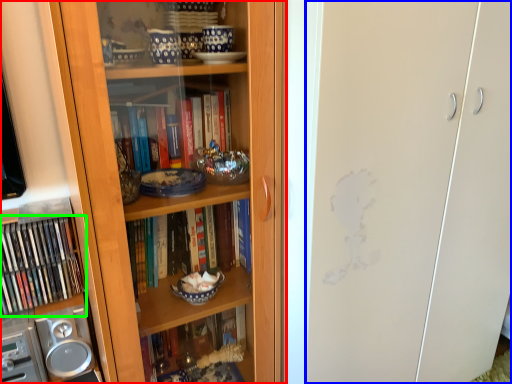
Question: Based on their relative distances, which object is farther from bookcase (highlighted by a red box)? Choose from glass door (highlighted by a blue box) and book (highlighted by a green box).

Choices:
 (A) glass door
 (B) book

Answer: (B)